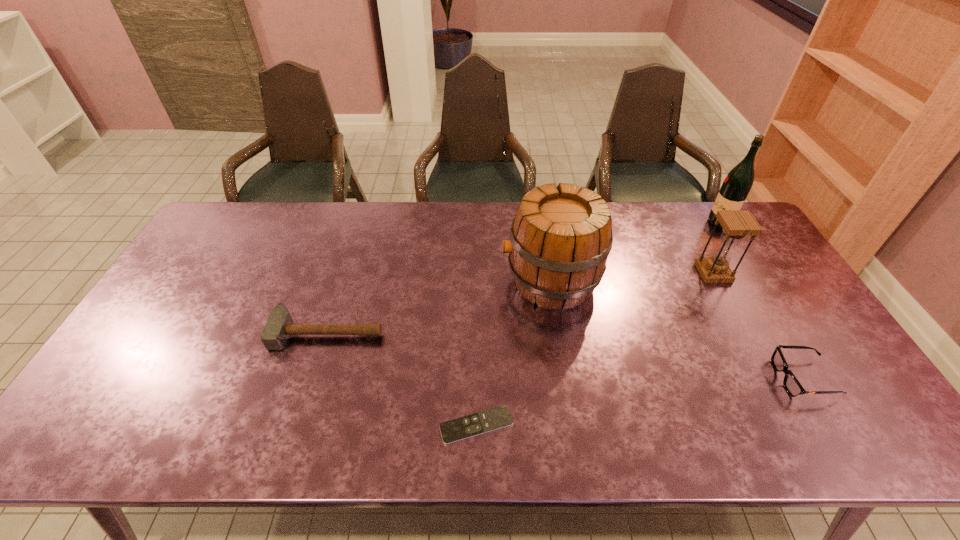
What are the coordinates of `vacant space in between the fifth shortest object and the remote control` in the screenshot? It's located at point(514,353).

Identify the location of free space between the fifth shortest object and the third tallest object. (632, 277).

Find the location of a particular element. empty location between the hourglass and the leftmost object is located at coordinates (520, 302).

The width and height of the screenshot is (960, 540). I want to click on free spot between the hammer and the sunglasses, so click(565, 355).

Locate an element on the screen. The width and height of the screenshot is (960, 540). unoccupied area between the sunglasses and the cider is located at coordinates (677, 329).

Where is `vacant space in between the second nearest object and the fifth shortest object`? vacant space in between the second nearest object and the fifth shortest object is located at coordinates (677, 329).

Identify the location of free space between the fourth shortest object and the second nearest object. (758, 326).

The image size is (960, 540). What are the coordinates of `free space between the farthest object and the fifth farthest object` in the screenshot? It's located at (761, 300).

The image size is (960, 540). I want to click on vacant space that is in between the leftmost object and the remote control, so click(x=402, y=379).

Locate an element on the screen. This screenshot has height=540, width=960. free spot between the hammer and the fifth shortest object is located at coordinates point(439,307).